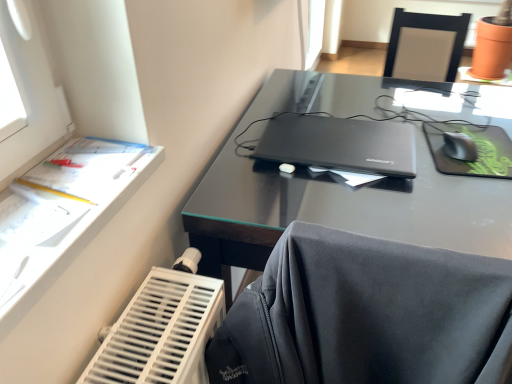
Image resolution: width=512 pixels, height=384 pixels. I want to click on free point behind black plastic mouse at right, so click(x=431, y=113).